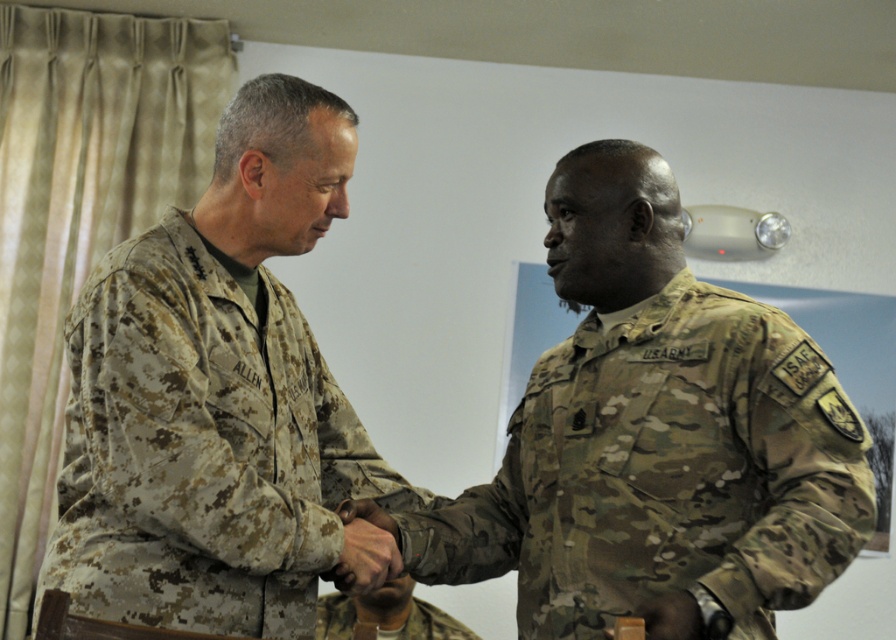
You are a photographer taking a picture of two military personnel. You notice the camouflage uniform at left and the camouflage fabric uniform at center. Which one is positioned higher in the frame?

The camouflage uniform at left is positioned higher in the frame than the camouflage fabric uniform at center.

You are an observer looking at the image of two military personnel shaking hands. You notice two uniforms labeled camouflage uniform at center and camouflage fabric uniform at center. Which of these two uniforms is positioned to the right side in the image?

The camouflage uniform at center is positioned to the right of the camouflage fabric uniform at center.

You are a photographer positioned at the center of the room. You need to take a photo of both the camouflage uniform at center and the camouflage uniform at left. Given that your camera has a maximum focus range of 12 inches, will you be able to capture both subjects clearly in the same photo?

The distance between the camouflage uniform at center and camouflage uniform at left is 13.49 inches, which exceeds the camera maximum focus range of 12 inches. Therefore, you will not be able to capture both subjects clearly in the same photo.